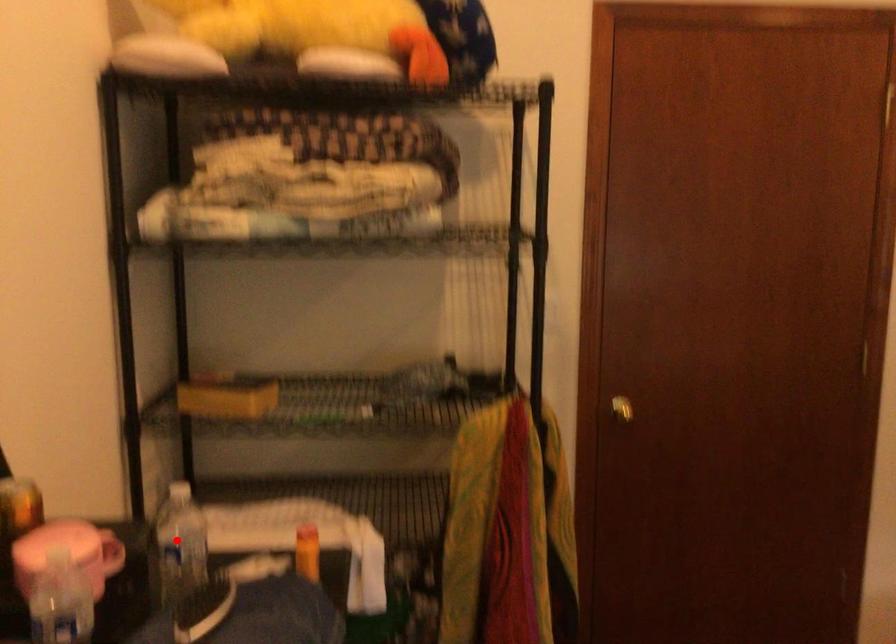
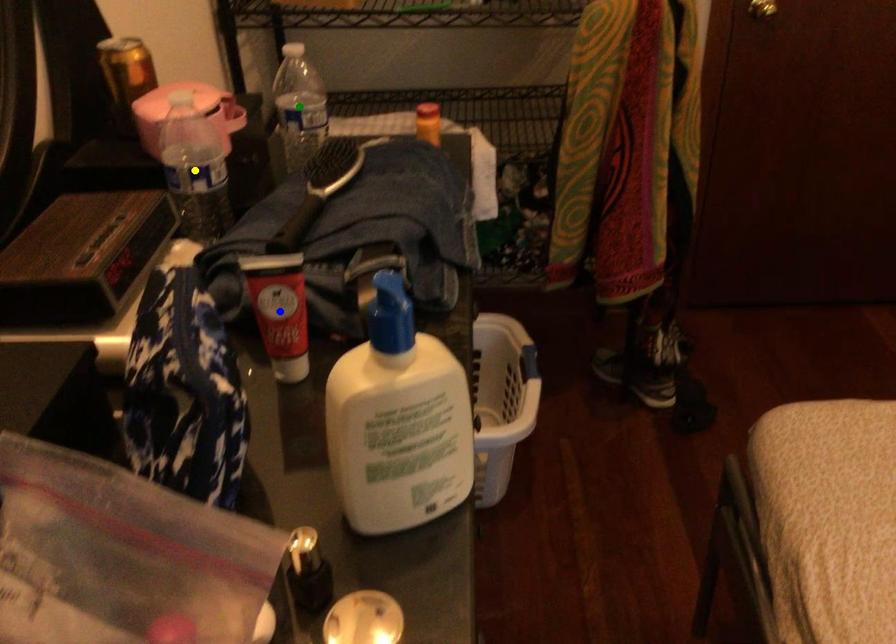
Question: I am providing you with two images of the same scene from different viewpoints. A red point is marked on the first image. You are given multiple points on the second image. Which spot in image 2 lines up with the point in image 1?

Choices:
 (A) green point
 (B) yellow point
 (C) blue point

Answer: (A)